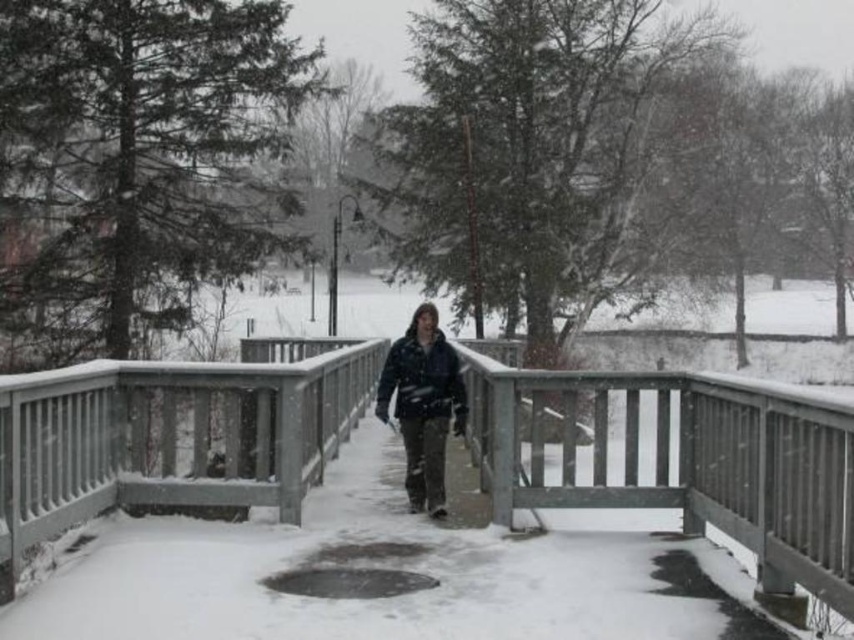
You are standing on a snowy path and need to cross to the other side. You see the wooden bridge at center and the dark blue jacket at center. Which object is taller?

The wooden bridge at center is taller than the dark blue jacket at center.

You are a snowplow operator trying to clear the wooden bridge at center. The dark blue jacket at center is a pedestrian walking on the bridge. Can you safely plow the bridge while the pedestrian is there?

The wooden bridge at center might be wider than dark blue jacket at center, so it is possible to safely plow the bridge while the pedestrian is there, as long as there is enough space for both the plow and the pedestrian to move safely on the bridge.